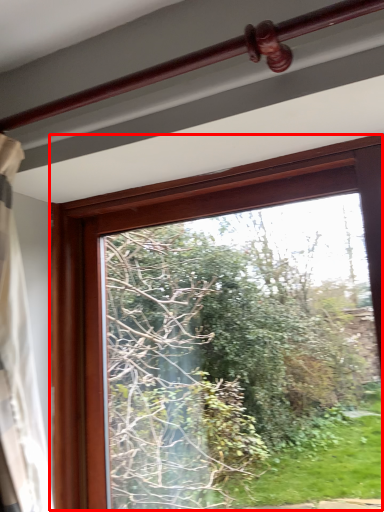
Question: Observing the image, what is the correct spatial positioning of window (annotated by the red box) in reference to rail?

Choices:
 (A) left
 (B) right

Answer: (B)